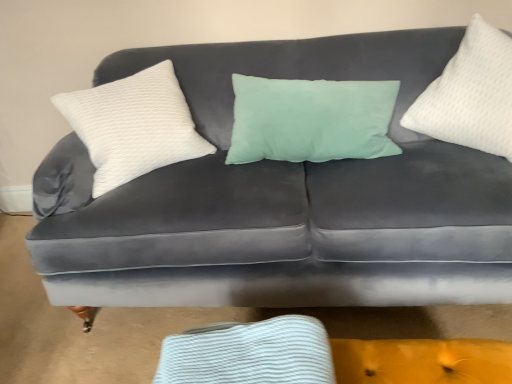
The height and width of the screenshot is (384, 512). What do you see at coordinates (470, 94) in the screenshot?
I see `white textured pillow at right, which appears as the second pillow when viewed from the left` at bounding box center [470, 94].

The image size is (512, 384). Identify the location of white textured pillow at right, which appears as the second pillow when viewed from the left. (470, 94).

This screenshot has height=384, width=512. I want to click on white textured pillow at left, arranged as the second pillow when viewed from the right, so click(x=133, y=126).

Describe the element at coordinates (133, 126) in the screenshot. The image size is (512, 384). I see `white textured pillow at left, acting as the first pillow starting from the left` at that location.

I want to click on white textured pillow at right, the 1th pillow from the right, so click(x=470, y=94).

Looking at this image, is white textured pillow at left, acting as the first pillow starting from the left, at the right side of white textured pillow at right, the 1th pillow from the right?

No, white textured pillow at left, acting as the first pillow starting from the left, is not to the right of white textured pillow at right, the 1th pillow from the right.

Considering the positions of objects white textured pillow at left, acting as the first pillow starting from the left, and white textured pillow at right, the 1th pillow from the right, in the image provided, who is in front, white textured pillow at left, acting as the first pillow starting from the left, or white textured pillow at right, the 1th pillow from the right,?

white textured pillow at right, the 1th pillow from the right, is closer to the camera.

Considering the points (134, 171) and (453, 87), which point is behind, point (134, 171) or point (453, 87)?

The point (134, 171) is farther.

From the image's perspective, which one is positioned higher, white textured pillow at left, acting as the first pillow starting from the left, or white textured pillow at right, which appears as the second pillow when viewed from the left?

From the image's view, white textured pillow at right, which appears as the second pillow when viewed from the left, is above.

From a real-world perspective, is white textured pillow at left, arranged as the second pillow when viewed from the right, physically below white textured pillow at right, which appears as the second pillow when viewed from the left?

Yes, from a real-world perspective, white textured pillow at left, arranged as the second pillow when viewed from the right, is under white textured pillow at right, which appears as the second pillow when viewed from the left.

Does white textured pillow at left, acting as the first pillow starting from the left, have a greater width compared to white textured pillow at right, which appears as the second pillow when viewed from the left?

Indeed, white textured pillow at left, acting as the first pillow starting from the left, has a greater width compared to white textured pillow at right, which appears as the second pillow when viewed from the left.

Can you confirm if white textured pillow at left, acting as the first pillow starting from the left, is taller than white textured pillow at right, which appears as the second pillow when viewed from the left?

In fact, white textured pillow at left, acting as the first pillow starting from the left, may be shorter than white textured pillow at right, which appears as the second pillow when viewed from the left.

Does white textured pillow at left, arranged as the second pillow when viewed from the right, have a larger size compared to white textured pillow at right, which appears as the second pillow when viewed from the left?

Yes, white textured pillow at left, arranged as the second pillow when viewed from the right, is bigger than white textured pillow at right, which appears as the second pillow when viewed from the left.

Would you say white textured pillow at left, arranged as the second pillow when viewed from the right, is outside white textured pillow at right, the 1th pillow from the right?

That's correct, white textured pillow at left, arranged as the second pillow when viewed from the right, is outside of white textured pillow at right, the 1th pillow from the right.

Is white textured pillow at left, arranged as the second pillow when viewed from the right, next to white textured pillow at right, the 1th pillow from the right?

No.

Could you tell me if white textured pillow at left, arranged as the second pillow when viewed from the right, is facing white textured pillow at right, the 1th pillow from the right?

No, white textured pillow at left, arranged as the second pillow when viewed from the right, does not turn towards white textured pillow at right, the 1th pillow from the right.

How many degrees apart are the facing directions of white textured pillow at left, acting as the first pillow starting from the left, and white textured pillow at right, which appears as the second pillow when viewed from the left?

81.2 degrees separate the facing orientations of white textured pillow at left, acting as the first pillow starting from the left, and white textured pillow at right, which appears as the second pillow when viewed from the left.

How much distance is there between white textured pillow at left, arranged as the second pillow when viewed from the right, and white textured pillow at right, the 1th pillow from the right?

white textured pillow at left, arranged as the second pillow when viewed from the right, and white textured pillow at right, the 1th pillow from the right, are 96.44 centimeters apart.

Locate an element on the screen. This screenshot has width=512, height=384. pillow beneath the white textured pillow at right, which appears as the second pillow when viewed from the left (from a real-world perspective) is located at coordinates (133, 126).

In the image, is white textured pillow at right, the 1th pillow from the right, on the left side or the right side of white textured pillow at left, acting as the first pillow starting from the left?

Clearly, white textured pillow at right, the 1th pillow from the right, is on the right of white textured pillow at left, acting as the first pillow starting from the left, in the image.

Looking at this image, considering the relative positions of white textured pillow at right, which appears as the second pillow when viewed from the left, and white textured pillow at left, arranged as the second pillow when viewed from the right, in the image provided, is white textured pillow at right, which appears as the second pillow when viewed from the left, in front of white textured pillow at left, arranged as the second pillow when viewed from the right,?

Yes, it is in front of white textured pillow at left, arranged as the second pillow when viewed from the right.

Considering the positions of points (461, 133) and (88, 101), is point (461, 133) closer to camera compared to point (88, 101)?

Yes, it is in front of point (88, 101).

From the image's perspective, is white textured pillow at right, which appears as the second pillow when viewed from the left, located beneath white textured pillow at left, acting as the first pillow starting from the left?

Actually, white textured pillow at right, which appears as the second pillow when viewed from the left, appears above white textured pillow at left, acting as the first pillow starting from the left, in the image.

From a real-world perspective, is white textured pillow at right, the 1th pillow from the right, above or below white textured pillow at left, acting as the first pillow starting from the left?

From a real-world perspective, white textured pillow at right, the 1th pillow from the right, is physically above white textured pillow at left, acting as the first pillow starting from the left.

In terms of width, does white textured pillow at right, which appears as the second pillow when viewed from the left, look wider or thinner when compared to white textured pillow at left, arranged as the second pillow when viewed from the right?

Considering their sizes, white textured pillow at right, which appears as the second pillow when viewed from the left, looks slimmer than white textured pillow at left, arranged as the second pillow when viewed from the right.

Does white textured pillow at right, which appears as the second pillow when viewed from the left, have a lesser height compared to white textured pillow at left, arranged as the second pillow when viewed from the right?

In fact, white textured pillow at right, which appears as the second pillow when viewed from the left, may be taller than white textured pillow at left, arranged as the second pillow when viewed from the right.

Considering the sizes of white textured pillow at right, the 1th pillow from the right, and white textured pillow at left, acting as the first pillow starting from the left, in the image, is white textured pillow at right, the 1th pillow from the right, bigger or smaller than white textured pillow at left, acting as the first pillow starting from the left,?

white textured pillow at right, the 1th pillow from the right, is smaller than white textured pillow at left, acting as the first pillow starting from the left.

Can we say white textured pillow at right, the 1th pillow from the right, lies outside white textured pillow at left, acting as the first pillow starting from the left?

Yes, white textured pillow at right, the 1th pillow from the right, is not within white textured pillow at left, acting as the first pillow starting from the left.

Is white textured pillow at right, which appears as the second pillow when viewed from the left, not close to white textured pillow at left, acting as the first pillow starting from the left?

No, white textured pillow at right, which appears as the second pillow when viewed from the left, is not far away from white textured pillow at left, acting as the first pillow starting from the left.

Is white textured pillow at right, the 1th pillow from the right, facing towards white textured pillow at left, acting as the first pillow starting from the left?

No, white textured pillow at right, the 1th pillow from the right, is not turned towards white textured pillow at left, acting as the first pillow starting from the left.

Image resolution: width=512 pixels, height=384 pixels. I want to click on pillow on the right of white textured pillow at left, acting as the first pillow starting from the left, so click(470, 94).

At what (x,y) coordinates should I click in order to perform the action: click on pillow that is on the right side of white textured pillow at left, arranged as the second pillow when viewed from the right. Please return your answer as a coordinate pair (x, y). The image size is (512, 384). Looking at the image, I should click on (470, 94).

This screenshot has width=512, height=384. What are the coordinates of `pillow lying below the white textured pillow at right, which appears as the second pillow when viewed from the left (from the image's perspective)` in the screenshot? It's located at (133, 126).